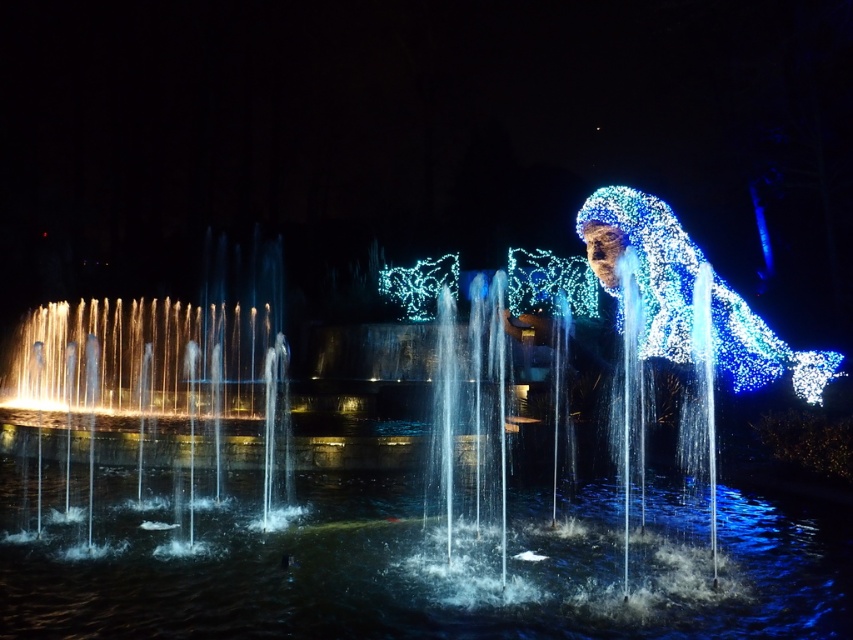
Does clear water at center come behind illuminated wireframe figure at right?

No, clear water at center is in front of illuminated wireframe figure at right.

Looking at this image, between clear water at center and illuminated wireframe figure at right, which one is positioned lower?

clear water at center

Based on the photo, measure the distance between clear water at center and camera.

clear water at center and camera are 96.12 feet apart.

You are a GUI agent. You are given a task and a screenshot of the screen. Output one action in this format:
    pyautogui.click(x=<x>, y=<y>)
    Task: Click on the clear water at center
    This screenshot has height=640, width=853.
    Given the screenshot: What is the action you would take?
    pyautogui.click(x=413, y=570)